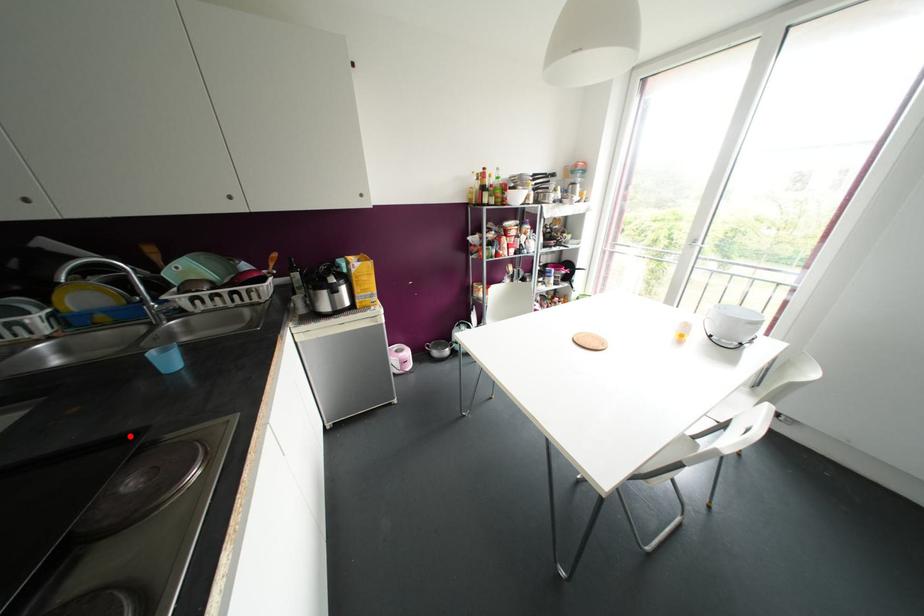
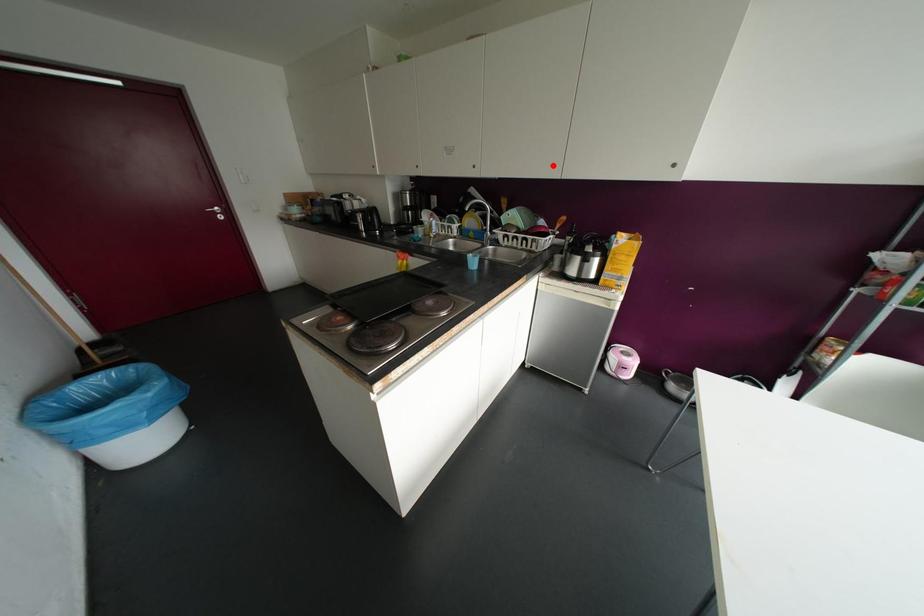
I am providing you with two images of the same scene from different viewpoints. A red point is marked on the first image and another point is marked on the second image. Are the points marked in image1 and image2 representing the same 3D position?

No